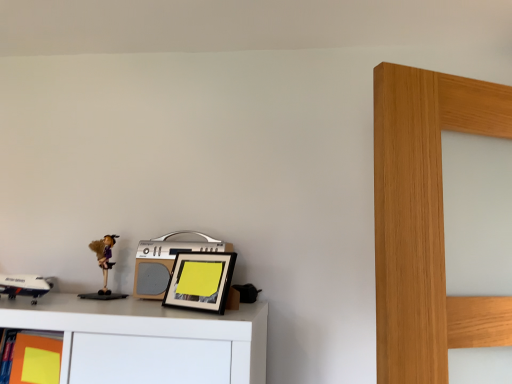
Question: From a real-world perspective, is black matte picture frame at center physically located above or below matte yellow sticky note at lower left?

Choices:
 (A) below
 (B) above

Answer: (B)

Question: In terms of width, does black matte picture frame at center look wider or thinner when compared to matte yellow sticky note at lower left?

Choices:
 (A) wide
 (B) thin

Answer: (A)

Question: Considering the real-world distances, which object is closest to the silver metallic stereo at center?

Choices:
 (A) matte yellow sticky note at lower left
 (B) matte purple doll at left
 (C) black matte picture frame at center

Answer: (C)

Question: Which object is the farthest from the black matte picture frame at center?

Choices:
 (A) silver metallic stereo at center
 (B) matte purple doll at left
 (C) matte yellow sticky note at lower left

Answer: (C)